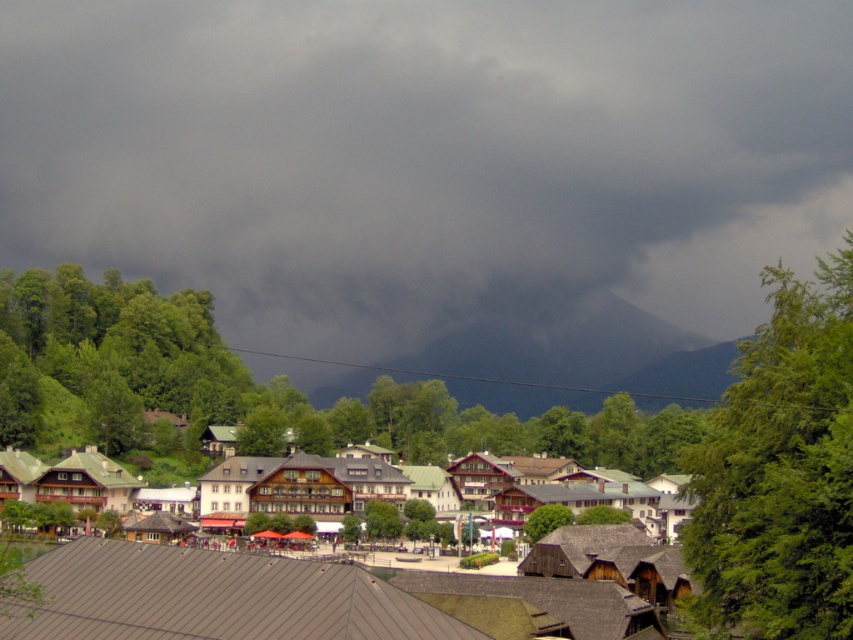
Question: Which point appears farthest from the camera in this image?

Choices:
 (A) (161, 481)
 (B) (515, 330)
 (C) (117, 204)

Answer: (C)

Question: Estimate the real-world distances between objects in this image. Which object is farther from the dark gray rock at center?

Choices:
 (A) wooden houses at center
 (B) dark gray cloud at upper center

Answer: (A)

Question: Does dark gray cloud at upper center appear over dark gray rock at center?

Choices:
 (A) yes
 (B) no

Answer: (A)

Question: Where is dark gray rock at center located in relation to wooden houses at center in the image?

Choices:
 (A) right
 (B) left

Answer: (A)

Question: Can you confirm if dark gray cloud at upper center is wider than dark gray rock at center?

Choices:
 (A) no
 (B) yes

Answer: (B)

Question: Which of the following is the closest to the observer?

Choices:
 (A) dark gray cloud at upper center
 (B) dark gray rock at center

Answer: (B)